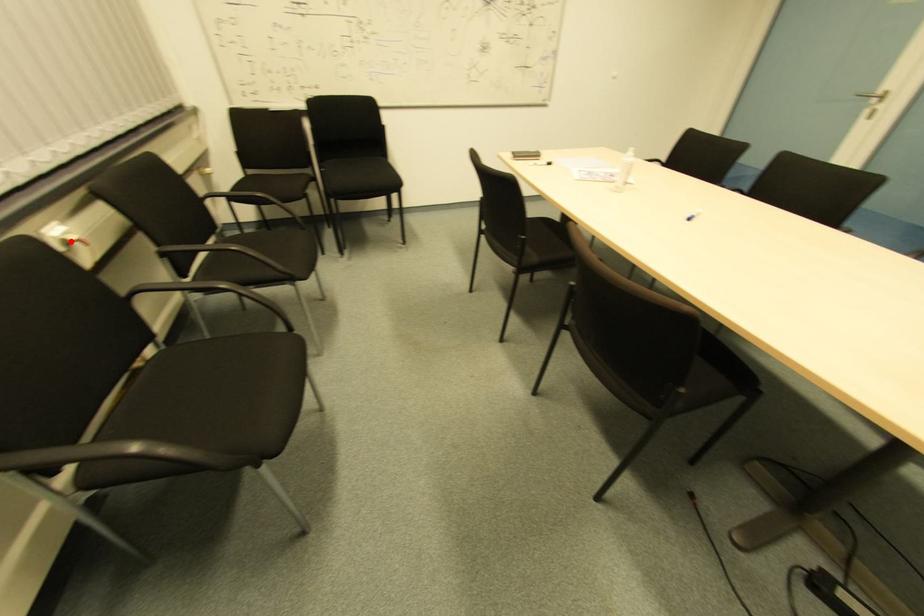
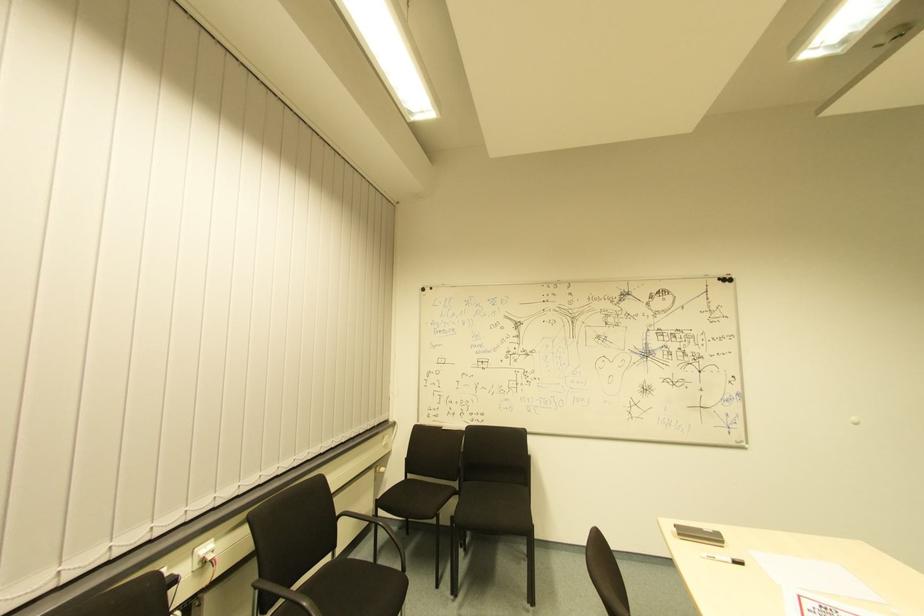
Find the pixel in the second image that matches the highlighted location in the first image.

(208, 561)